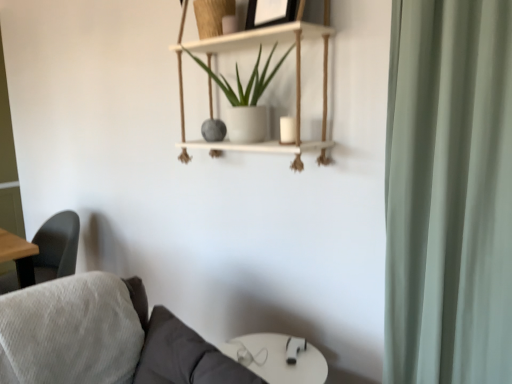
This screenshot has width=512, height=384. What do you see at coordinates (270, 12) in the screenshot?
I see `wooden picture frame at upper center` at bounding box center [270, 12].

Find the location of `white wood shelf at upper center`. white wood shelf at upper center is located at coordinates tap(296, 84).

Where is `wooden picture frame at upper center`? This screenshot has height=384, width=512. wooden picture frame at upper center is located at coordinates (270, 12).

Considering the sizes of objects white wood shelf at upper center and white glossy round table at lower center in the image provided, who is wider, white wood shelf at upper center or white glossy round table at lower center?

Wider between the two is white glossy round table at lower center.

Which of these two, white wood shelf at upper center or white glossy round table at lower center, is smaller?

With smaller size is white glossy round table at lower center.

Who is taller, white wood shelf at upper center or white glossy round table at lower center?

Standing taller between the two is white wood shelf at upper center.

Is white wood shelf at upper center looking in the opposite direction of white glossy round table at lower center?

white wood shelf at upper center is not turned away from white glossy round table at lower center.

Which is behind, white wood shelf at upper center or wooden picture frame at upper center?

wooden picture frame at upper center.

Is white wood shelf at upper center oriented away from wooden picture frame at upper center?

Correct, white wood shelf at upper center is looking away from wooden picture frame at upper center.

From the image's perspective, does white wood shelf at upper center appear lower than wooden picture frame at upper center?

Yes, from the image's perspective, white wood shelf at upper center is beneath wooden picture frame at upper center.

Which is more to the left, white matte pot at upper center or white glossy round table at lower center?

white matte pot at upper center.

Considering the positions of point (203, 66) and point (293, 340), is point (203, 66) closer or farther from the camera than point (293, 340)?

Point (203, 66) is positioned farther from the camera compared to point (293, 340).

Considering the sizes of white matte pot at upper center and white glossy round table at lower center in the image, is white matte pot at upper center wider or thinner than white glossy round table at lower center?

In the image, white matte pot at upper center appears to be more narrow than white glossy round table at lower center.

Could you tell me if white matte pot at upper center is facing white glossy round table at lower center?

No, white matte pot at upper center is not aimed at white glossy round table at lower center.

Does point (277, 15) appear closer or farther from the camera than point (325, 126)?

Point (277, 15) is positioned closer to the camera compared to point (325, 126).

Considering the positions of objects wooden picture frame at upper center and white wood shelf at upper center in the image provided, who is in front, wooden picture frame at upper center or white wood shelf at upper center?

white wood shelf at upper center is more forward.

Considering the relative sizes of wooden picture frame at upper center and white wood shelf at upper center in the image provided, is wooden picture frame at upper center bigger than white wood shelf at upper center?

No, wooden picture frame at upper center is not bigger than white wood shelf at upper center.

From a real-world perspective, is wooden picture frame at upper center on top of white glossy round table at lower center?

Yes, from a real-world perspective, wooden picture frame at upper center is on top of white glossy round table at lower center.

Is point (256, 23) closer to camera compared to point (309, 357)?

Yes, it is.

Is white wood shelf at upper center inside white matte pot at upper center?

Absolutely, white wood shelf at upper center is inside white matte pot at upper center.

Which object is further away from the camera, white matte pot at upper center or white wood shelf at upper center?

white matte pot at upper center is further away from the camera.

From a real-world perspective, is white matte pot at upper center located beneath white wood shelf at upper center?

Indeed, from a real-world perspective, white matte pot at upper center is positioned beneath white wood shelf at upper center.

Is textured gray fabric couch at lower left aimed at white glossy round table at lower center?

No.

Considering the relative sizes of textured gray fabric couch at lower left and white glossy round table at lower center in the image provided, is textured gray fabric couch at lower left thinner than white glossy round table at lower center?

Incorrect, the width of textured gray fabric couch at lower left is not less than that of white glossy round table at lower center.

Is textured gray fabric couch at lower left placed right next to white glossy round table at lower center?

No, textured gray fabric couch at lower left is not touching white glossy round table at lower center.

Is textured gray fabric couch at lower left at the right side of white glossy round table at lower center?

No.

What are the coordinates of `round table behind the white wood shelf at upper center` in the screenshot? It's located at (278, 358).

The width and height of the screenshot is (512, 384). I want to click on picture frame on the right of white wood shelf at upper center, so click(x=270, y=12).

From the image, which object appears to be farther from white matte pot at upper center, white wood shelf at upper center or textured gray fabric couch at lower left?

Based on the image, textured gray fabric couch at lower left appears to be further to white matte pot at upper center.

Looking at the image, which one is located further to white matte pot at upper center, wooden picture frame at upper center or white glossy round table at lower center?

white glossy round table at lower center is further to white matte pot at upper center.

From the picture: Estimate the real-world distances between objects in this image. Which object is closer to white matte pot at upper center, textured gray fabric couch at lower left or white glossy round table at lower center?

textured gray fabric couch at lower left lies closer to white matte pot at upper center than the other object.

Looking at the image, which one is located further to white wood shelf at upper center, white matte pot at upper center or textured gray fabric couch at lower left?

→ Among the two, textured gray fabric couch at lower left is located further to white wood shelf at upper center.

Considering their positions, is white matte pot at upper center positioned further to white glossy round table at lower center than textured gray fabric couch at lower left?

Among the two, white matte pot at upper center is located further to white glossy round table at lower center.

Considering their positions, is white matte pot at upper center positioned closer to white glossy round table at lower center than white wood shelf at upper center?

white wood shelf at upper center.

Estimate the real-world distances between objects in this image. Which object is closer to textured gray fabric couch at lower left, white glossy round table at lower center or white wood shelf at upper center?

Among the two, white glossy round table at lower center is located nearer to textured gray fabric couch at lower left.

Considering their positions, is white glossy round table at lower center positioned further to wooden picture frame at upper center than white matte pot at upper center?

Among the two, white glossy round table at lower center is located further to wooden picture frame at upper center.

Find the location of a particular element. This screenshot has width=512, height=384. cabinet between wooden picture frame at upper center and white glossy round table at lower center from top to bottom is located at coordinates 296,84.

Find the location of `houseplant between wooden picture frame at upper center and white glossy round table at lower center from top to bottom`. houseplant between wooden picture frame at upper center and white glossy round table at lower center from top to bottom is located at coordinates (248, 81).

What are the coordinates of `studio couch that lies between wooden picture frame at upper center and white glossy round table at lower center from top to bottom` in the screenshot? It's located at (153, 336).

Where is `houseplant between wooden picture frame at upper center and textured gray fabric couch at lower left in the vertical direction`? houseplant between wooden picture frame at upper center and textured gray fabric couch at lower left in the vertical direction is located at coordinates (248, 81).